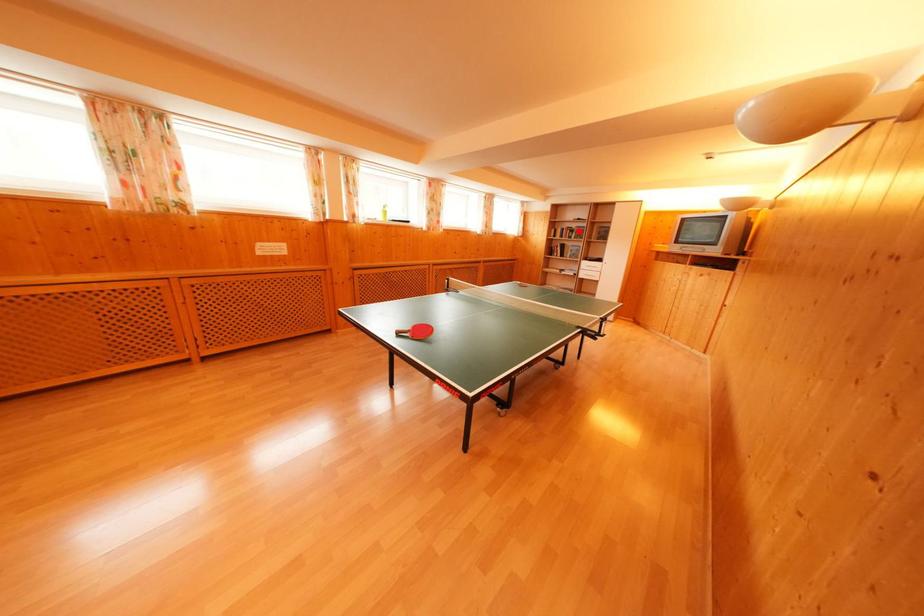
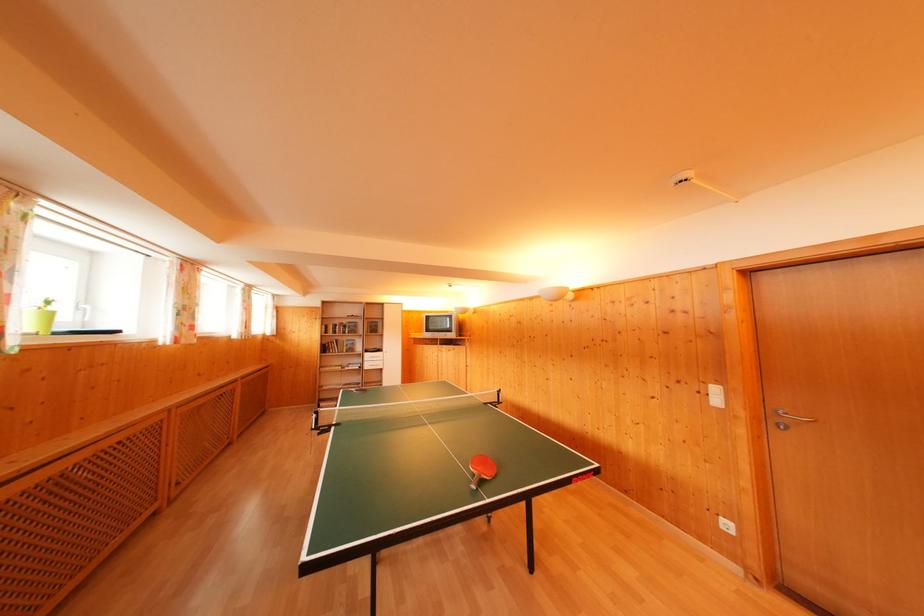
Question: A red point is marked in image1. In image2, is the corresponding 3D point closer to the camera or farther? Reply with the corresponding letter.

Choices:
 (A) The corresponding 3D point is closer.
 (B) The corresponding 3D point is farther.

Answer: (B)